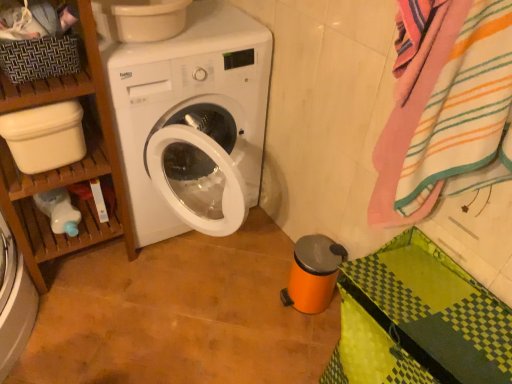
Question: From the image's perspective, is striped cotton bath towel at right above or below woven brown basket at upper left?

Choices:
 (A) above
 (B) below

Answer: (B)

Question: Looking at their shapes, would you say striped cotton bath towel at right is wider or thinner than woven brown basket at upper left?

Choices:
 (A) thin
 (B) wide

Answer: (A)

Question: Which of these objects is positioned closest to the striped cotton bath towel at right?

Choices:
 (A) woven brown basket at upper left
 (B) wooden shelf at left

Answer: (B)

Question: Considering the real-world distances, which object is closest to the striped cotton bath towel at right?

Choices:
 (A) woven brown basket at upper left
 (B) wooden shelf at left

Answer: (B)